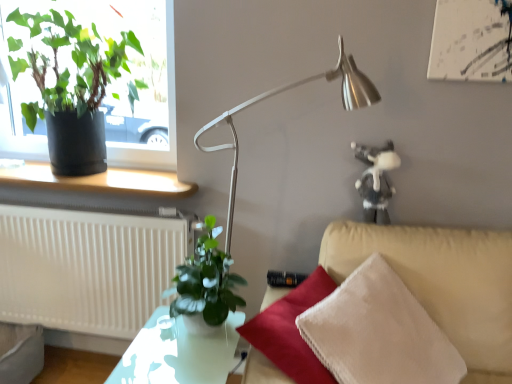
At what (x,y) coordinates should I click in order to perform the action: click on free space on the front side of green matte plant at center, which is counted as the first houseplant, starting from the right. Please return your answer as a coordinate pair (x, y). Image resolution: width=512 pixels, height=384 pixels. Looking at the image, I should click on (175, 368).